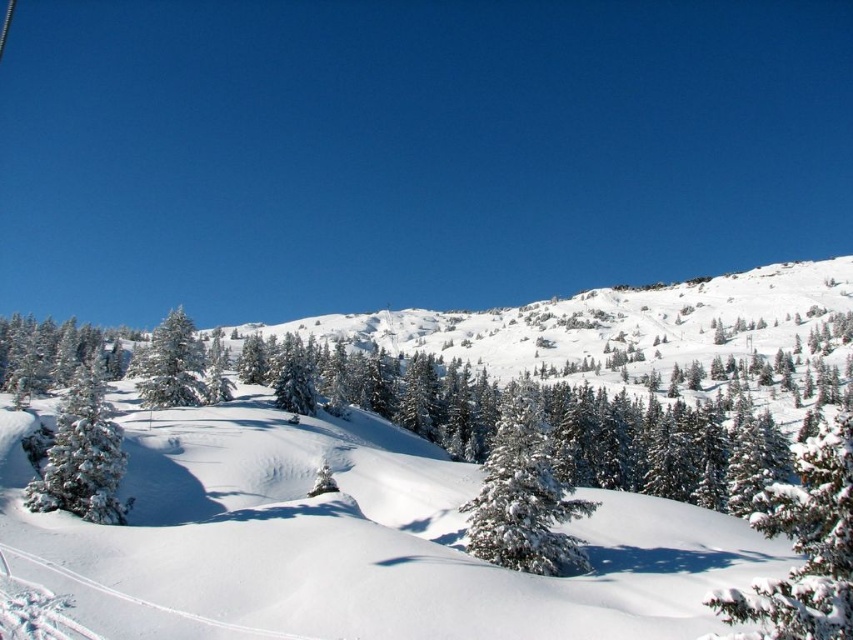
From the picture: You are planning to set up a small tent between the green textured pine at lower right and the green matte tree at left. Considering the space between them, would there be enough room for the tent which requires 3 meters of width?

The green textured pine at lower right might be wider than the green matte tree at left, but without exact measurements of their widths, it is uncertain if the space between them can accommodate a 3 meter wide tent. Further assessment is needed.